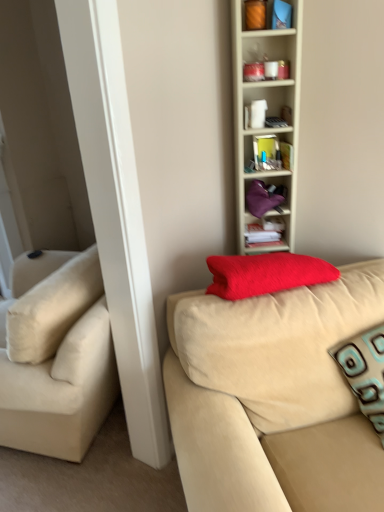
Question: Is orange matte candle at upper center, positioned as the 1th cabinet in front-to-back order, bigger than teal patterned pillow at right?

Choices:
 (A) no
 (B) yes

Answer: (A)

Question: Are orange matte candle at upper center, acting as the first cabinet starting from the top, and teal patterned pillow at right far apart?

Choices:
 (A) no
 (B) yes

Answer: (B)

Question: Is teal patterned pillow at right located within orange matte candle at upper center, which ranks as the second cabinet in back-to-front order?

Choices:
 (A) yes
 (B) no

Answer: (B)

Question: From a real-world perspective, does orange matte candle at upper center, which ranks as the second cabinet in back-to-front order, sit lower than teal patterned pillow at right?

Choices:
 (A) no
 (B) yes

Answer: (A)

Question: From the image's perspective, is orange matte candle at upper center, acting as the first cabinet starting from the top, beneath teal patterned pillow at right?

Choices:
 (A) yes
 (B) no

Answer: (B)

Question: From a real-world perspective, is velvet beige couch at center above or below purple fabric bag at upper center, the 1th cabinet from the back?

Choices:
 (A) above
 (B) below

Answer: (B)

Question: In the image, is velvet beige couch at center on the left side or the right side of purple fabric bag at upper center, marked as the second cabinet in a top-to-bottom arrangement?

Choices:
 (A) right
 (B) left

Answer: (A)

Question: Looking at their shapes, would you say velvet beige couch at center is wider or thinner than purple fabric bag at upper center, the second cabinet when ordered from front to back?

Choices:
 (A) wide
 (B) thin

Answer: (A)

Question: Based on their sizes in the image, would you say velvet beige couch at center is bigger or smaller than purple fabric bag at upper center, acting as the 1th cabinet starting from the bottom?

Choices:
 (A) small
 (B) big

Answer: (B)

Question: Based on their positions, is velvet beige couch at center located to the left or right of teal patterned pillow at right?

Choices:
 (A) left
 (B) right

Answer: (A)

Question: From a real-world perspective, is velvet beige couch at center above or below teal patterned pillow at right?

Choices:
 (A) above
 (B) below

Answer: (B)

Question: Would you say velvet beige couch at center is inside or outside teal patterned pillow at right?

Choices:
 (A) outside
 (B) inside

Answer: (A)

Question: Does point (203, 416) appear closer or farther from the camera than point (375, 345)?

Choices:
 (A) closer
 (B) farther

Answer: (A)

Question: From the image's perspective, is orange matte candle at upper center, marked as the 2th cabinet in a bottom-to-top arrangement, located above or below velvet beige couch at center?

Choices:
 (A) below
 (B) above

Answer: (B)

Question: Do you think orange matte candle at upper center, positioned as the 1th cabinet in front-to-back order, is within velvet beige couch at center, or outside of it?

Choices:
 (A) outside
 (B) inside

Answer: (A)